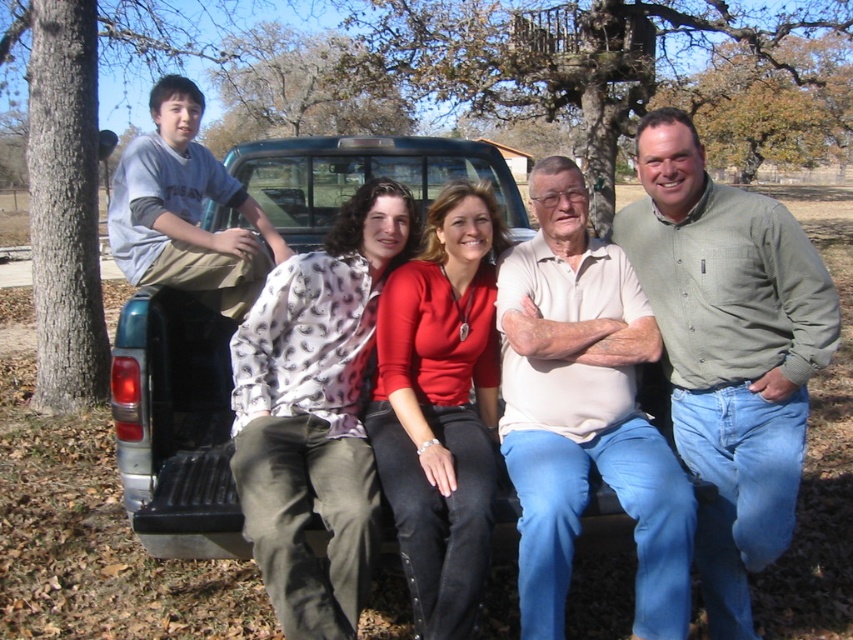
You are standing at the point marked as point (x=670, y=540) and want to throw a ball to someone standing 3 meters away. Can you reach them with your throw?

The distance between you and the viewer is 2.48 meters, so yes, you can reach them since 2.48 meters is less than 3 meters.

Based on the scene description, can you determine the spatial relationship between the light beige cotton shirt at center and the teal matte truck bed at center? Please explain your reasoning using the provided information.

The light beige cotton shirt at center is located below the teal matte truck bed at center, meaning the shirt is positioned lower in the image relative to the truck bed.